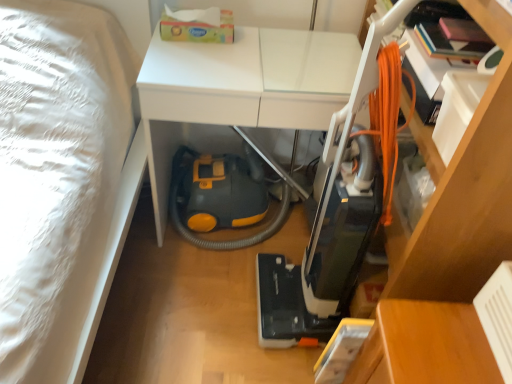
Question: Can you confirm if white glossy table at center, the 1th table positioned from the left, is bigger than wooden table at lower right, marked as the first table in a right-to-left arrangement?

Choices:
 (A) no
 (B) yes

Answer: (B)

Question: Does white glossy table at center, which is the 2th table from bottom to top, lie in front of wooden table at lower right, positioned as the 2th table in left-to-right order?

Choices:
 (A) no
 (B) yes

Answer: (A)

Question: Considering the relative sizes of white glossy table at center, positioned as the second table in right-to-left order, and wooden table at lower right, positioned as the 2th table in left-to-right order, in the image provided, is white glossy table at center, positioned as the second table in right-to-left order, wider than wooden table at lower right, positioned as the 2th table in left-to-right order,?

Choices:
 (A) no
 (B) yes

Answer: (B)

Question: From the image's perspective, is white glossy table at center, which is the 2th table from bottom to top, beneath wooden table at lower right, the second table viewed from the top?

Choices:
 (A) yes
 (B) no

Answer: (B)

Question: From a real-world perspective, is white glossy table at center, positioned as the second table in right-to-left order, positioned under wooden table at lower right, placed as the 1th table when sorted from bottom to top, based on gravity?

Choices:
 (A) no
 (B) yes

Answer: (A)

Question: Can you confirm if white glossy table at center, the 1th table positioned from the left, is thinner than wooden table at lower right, placed as the 1th table when sorted from bottom to top?

Choices:
 (A) yes
 (B) no

Answer: (B)

Question: Is white glossy table at center, the 1th table positioned from the left, thinner than orange corded vacuum cleaner at center?

Choices:
 (A) yes
 (B) no

Answer: (B)

Question: From a real-world perspective, is white glossy table at center, placed as the 1th table when sorted from top to bottom, located higher than orange corded vacuum cleaner at center?

Choices:
 (A) no
 (B) yes

Answer: (A)

Question: Is white glossy table at center, which is the 2th table from bottom to top, to the left of orange corded vacuum cleaner at center from the viewer's perspective?

Choices:
 (A) no
 (B) yes

Answer: (B)

Question: Can you confirm if white glossy table at center, which is the 2th table from bottom to top, is smaller than orange corded vacuum cleaner at center?

Choices:
 (A) no
 (B) yes

Answer: (A)

Question: Is white glossy table at center, positioned as the second table in right-to-left order, taller than orange corded vacuum cleaner at center?

Choices:
 (A) no
 (B) yes

Answer: (A)

Question: Is the depth of white glossy table at center, the 1th table positioned from the left, greater than that of orange corded vacuum cleaner at center?

Choices:
 (A) no
 (B) yes

Answer: (B)

Question: From a real-world perspective, is orange corded vacuum cleaner at center over white glossy table at center, the 1th table positioned from the left?

Choices:
 (A) yes
 (B) no

Answer: (A)